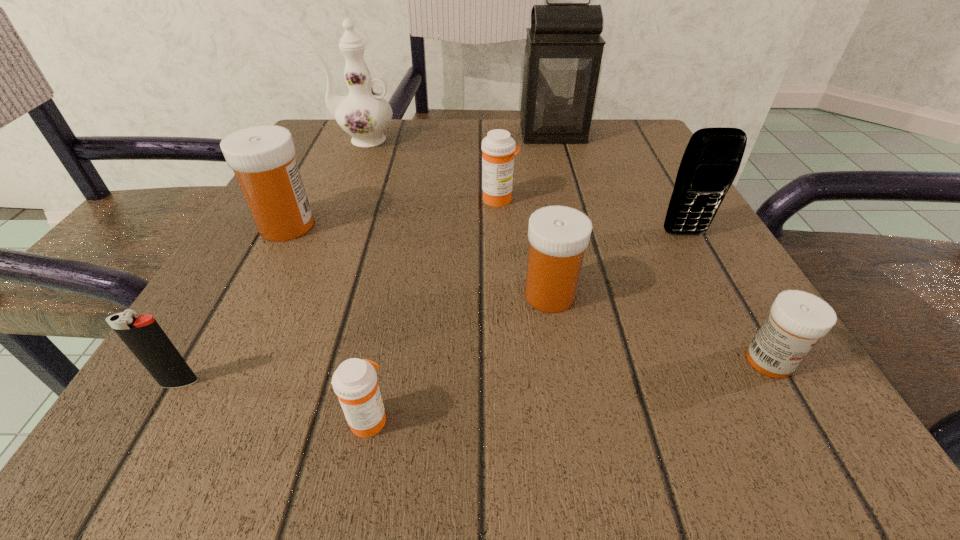
Locate an element on the screen. cellular telephone that is positioned at the right edge is located at coordinates (710, 163).

Where is `medicine that is at the right edge`? This screenshot has width=960, height=540. medicine that is at the right edge is located at coordinates (797, 320).

What are the coordinates of `object positioned at the far left corner` in the screenshot? It's located at (364, 114).

Where is `object at the near left corner`? This screenshot has width=960, height=540. object at the near left corner is located at coordinates (145, 338).

Locate an element on the screen. This screenshot has width=960, height=540. object present at the far right corner is located at coordinates (561, 67).

Where is `object located in the near right corner section of the desktop`? This screenshot has width=960, height=540. object located in the near right corner section of the desktop is located at coordinates (797, 320).

This screenshot has width=960, height=540. What are the coordinates of `free space at the far edge of the desktop` in the screenshot? It's located at (384, 157).

The height and width of the screenshot is (540, 960). Find the location of `vacant area at the near edge`. vacant area at the near edge is located at coordinates (537, 414).

Where is `free space at the left edge of the desktop`? This screenshot has height=540, width=960. free space at the left edge of the desktop is located at coordinates 198,354.

The width and height of the screenshot is (960, 540). Identify the location of vacant space at the right edge of the desktop. (710, 269).